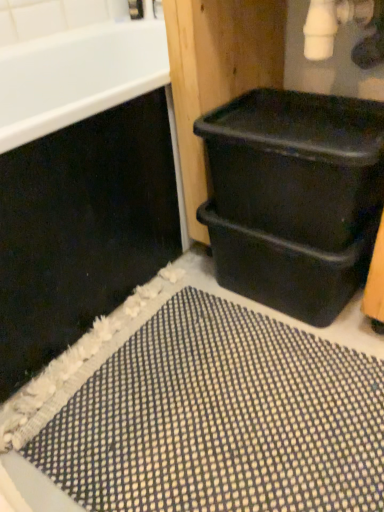
Describe the element at coordinates (212, 417) in the screenshot. The image size is (384, 512). I see `black textured bath mat at lower right` at that location.

Measure the distance between black plastic bin at lower right and camera.

The depth of black plastic bin at lower right is 34.71 inches.

Image resolution: width=384 pixels, height=512 pixels. Describe the element at coordinates (294, 197) in the screenshot. I see `black plastic bin at right` at that location.

The height and width of the screenshot is (512, 384). I want to click on black textured bath mat at lower right, so click(x=212, y=417).

Relative to black plastic bin at right, is black textured bath mat at lower right in front or behind?

Clearly, black textured bath mat at lower right is in front of black plastic bin at right.

Which is correct: black textured bath mat at lower right is inside black plastic bin at right, or outside of it?

The correct answer is: outside.

Considering the positions of objects black textured bath mat at lower right and black plastic bin at right in the image provided, who is more to the left, black textured bath mat at lower right or black plastic bin at right?

Positioned to the left is black textured bath mat at lower right.

From a real-world perspective, is black textured bath mat at lower right on top of black plastic bin at right?

Actually, black textured bath mat at lower right is physically below black plastic bin at right in the real world.

Are black plastic bin at right and black textured bath mat at lower right located far from each other?

black plastic bin at right is actually quite close to black textured bath mat at lower right.

Does black plastic bin at right appear on the left side of black textured bath mat at lower right?

Incorrect, black plastic bin at right is not on the left side of black textured bath mat at lower right.

Is black plastic bin at right thinner than black textured bath mat at lower right?

Indeed, black plastic bin at right has a lesser width compared to black textured bath mat at lower right.

Considering the points (365, 172) and (175, 385), which point is behind, point (365, 172) or point (175, 385)?

The point (175, 385) is farther.

Is black plastic bin at right bigger than black plastic tub at right?

Actually, black plastic bin at right might be smaller than black plastic tub at right.

This screenshot has width=384, height=512. In order to click on waste container that is above the black plastic tub at right (from a real-world perspective) in this screenshot , I will do `click(294, 197)`.

Is black plastic bin at right not near black plastic tub at right?

No, black plastic bin at right is not far away from black plastic tub at right.

Consider the image. Measure the distance between black plastic bin at right and black plastic tub at right.

black plastic bin at right is 13.00 inches away from black plastic tub at right.

Between black plastic bin at lower right and black textured bath mat at lower right, which one has more height?

Standing taller between the two is black plastic bin at lower right.

Looking at this image, is black textured bath mat at lower right located within black plastic bin at lower right?

No, black textured bath mat at lower right is not surrounded by black plastic bin at lower right.

Based on their positions, is black plastic bin at lower right located to the left or right of black textured bath mat at lower right?

black plastic bin at lower right is to the right of black textured bath mat at lower right.

This screenshot has width=384, height=512. What are the coordinates of `bath mat directly beneath the black plastic tub at right (from a real-world perspective)` in the screenshot? It's located at (212, 417).

In terms of width, does black plastic tub at right look wider or thinner when compared to black textured bath mat at lower right?

Considering their sizes, black plastic tub at right looks broader than black textured bath mat at lower right.

Which is behind, point (170, 203) or point (319, 402)?

The point (170, 203) is farther from the camera.

Are black plastic tub at right and black textured bath mat at lower right located far from each other?

No, black plastic tub at right is in close proximity to black textured bath mat at lower right.

Can you confirm if black textured bath mat at lower right is positioned to the left of black plastic bin at lower right?

Correct, you'll find black textured bath mat at lower right to the left of black plastic bin at lower right.

The image size is (384, 512). Identify the location of drawer behind the black textured bath mat at lower right. (286, 268).

Which of these two, black textured bath mat at lower right or black plastic bin at lower right, is thinner?

black plastic bin at lower right.

Is the surface of black textured bath mat at lower right in direct contact with black plastic bin at lower right?

black textured bath mat at lower right and black plastic bin at lower right are clearly separated.

Is black plastic tub at right at the back of black textured bath mat at lower right?

black textured bath mat at lower right is not turned away from black plastic tub at right.

Which is more to the left, black textured bath mat at lower right or black plastic tub at right?

From the viewer's perspective, black plastic tub at right appears more on the left side.

Measure the distance between black textured bath mat at lower right and black plastic tub at right.

black textured bath mat at lower right and black plastic tub at right are 14.06 inches apart.

Can you confirm if black textured bath mat at lower right is taller than black plastic tub at right?

In fact, black textured bath mat at lower right may be shorter than black plastic tub at right.

Identify the location of bath mat below the black plastic bin at right (from a real-world perspective). The height and width of the screenshot is (512, 384). (212, 417).

Identify the location of bath mat to the left of black plastic bin at right. (212, 417).

When comparing their distances from black textured bath mat at lower right, does black plastic tub at right or black plastic bin at lower right seem closer?

Among the two, black plastic bin at lower right is located nearer to black textured bath mat at lower right.

Considering their positions, is black textured bath mat at lower right positioned further to black plastic bin at right than black plastic bin at lower right?

Based on the image, black textured bath mat at lower right appears to be further to black plastic bin at right.

Looking at the image, which one is located closer to black plastic tub at right, black textured bath mat at lower right or black plastic bin at lower right?

black plastic bin at lower right is closer to black plastic tub at right.

Which object lies further to the anchor point black textured bath mat at lower right, black plastic bin at right or black plastic bin at lower right?

Based on the image, black plastic bin at right appears to be further to black textured bath mat at lower right.

When comparing their distances from black plastic tub at right, does black plastic bin at lower right or black plastic bin at right seem further?

black plastic bin at lower right is further to black plastic tub at right.

From the image, which object appears to be nearer to black plastic tub at right, black plastic bin at lower right or black textured bath mat at lower right?

Among the two, black plastic bin at lower right is located nearer to black plastic tub at right.

Based on their spatial positions, is black plastic bin at lower right or black textured bath mat at lower right closer to black plastic bin at right?

black plastic bin at lower right.

Estimate the real-world distances between objects in this image. Which object is closer to black plastic tub at right, black plastic bin at right or black textured bath mat at lower right?

black plastic bin at right is positioned closer to the anchor black plastic tub at right.

Image resolution: width=384 pixels, height=512 pixels. Find the location of `waste container situated between black plastic tub at right and black plastic bin at lower right from left to right`. waste container situated between black plastic tub at right and black plastic bin at lower right from left to right is located at coordinates (294, 197).

Locate an element on the screen. drawer that lies between black plastic tub at right and black textured bath mat at lower right from top to bottom is located at coordinates point(286,268).

Find the location of a particular element. The image size is (384, 512). waste container between black plastic tub at right and black textured bath mat at lower right from top to bottom is located at coordinates (294, 197).

The image size is (384, 512). I want to click on drawer between black plastic bin at right and black textured bath mat at lower right in the vertical direction, so click(286, 268).